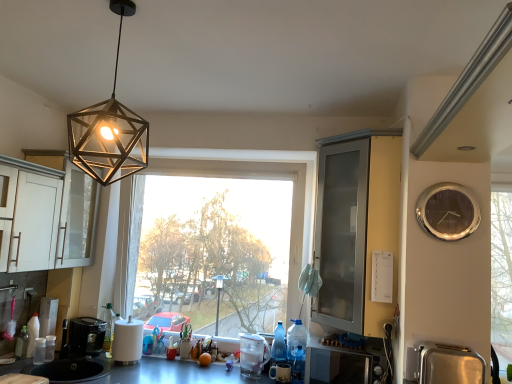
Find the location of a particular element. This screenshot has height=384, width=512. free space in front of clear plastic blender at center, which is counted as the 3th appliance, starting from the right is located at coordinates (246, 380).